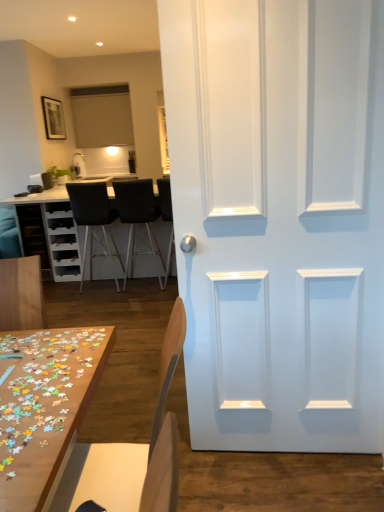
Question: Considering the relative sizes of wooden puzzle pieces at lower left, acting as the second table starting from the back, and matte black cabinet at left in the image provided, is wooden puzzle pieces at lower left, acting as the second table starting from the back, thinner than matte black cabinet at left?

Choices:
 (A) no
 (B) yes

Answer: (A)

Question: Does wooden puzzle pieces at lower left, the 2th table from the top, have a smaller size compared to matte black cabinet at left?

Choices:
 (A) yes
 (B) no

Answer: (A)

Question: Is the surface of wooden puzzle pieces at lower left, the first table ordered from the bottom, in direct contact with matte black cabinet at left?

Choices:
 (A) yes
 (B) no

Answer: (B)

Question: Does wooden puzzle pieces at lower left, which appears as the 2th table when viewed from the left, contain matte black cabinet at left?

Choices:
 (A) no
 (B) yes

Answer: (A)

Question: From a real-world perspective, is wooden puzzle pieces at lower left, acting as the second table starting from the back, located higher than matte black cabinet at left?

Choices:
 (A) no
 (B) yes

Answer: (B)

Question: Does wooden puzzle pieces at lower left, the first table ordered from the bottom, lie behind matte black cabinet at left?

Choices:
 (A) no
 (B) yes

Answer: (A)

Question: Is matte black cabinet at left outside of light brown wood chair at lower center, which is counted as the 4th chair, starting from the back?

Choices:
 (A) yes
 (B) no

Answer: (A)

Question: From the image's perspective, is matte black cabinet at left below light brown wood chair at lower center, which is counted as the 4th chair, starting from the back?

Choices:
 (A) no
 (B) yes

Answer: (A)

Question: Considering the relative positions of matte black cabinet at left and light brown wood chair at lower center, which is counted as the 1th chair, starting from the front, in the image provided, is matte black cabinet at left in front of light brown wood chair at lower center, which is counted as the 1th chair, starting from the front,?

Choices:
 (A) yes
 (B) no

Answer: (B)

Question: Can you confirm if matte black cabinet at left is positioned to the right of light brown wood chair at lower center, which is counted as the 4th chair, starting from the back?

Choices:
 (A) yes
 (B) no

Answer: (B)

Question: Is matte black cabinet at left turned away from light brown wood chair at lower center, which is counted as the 4th chair, starting from the back?

Choices:
 (A) no
 (B) yes

Answer: (A)

Question: Does matte black cabinet at left have a greater height compared to light brown wood chair at lower center, which is counted as the 4th chair, starting from the back?

Choices:
 (A) yes
 (B) no

Answer: (B)

Question: Can you confirm if black leather chair at center, acting as the 1th chair starting from the back, is thinner than black leather chair at center, the 2th chair when ordered from front to back?

Choices:
 (A) no
 (B) yes

Answer: (A)